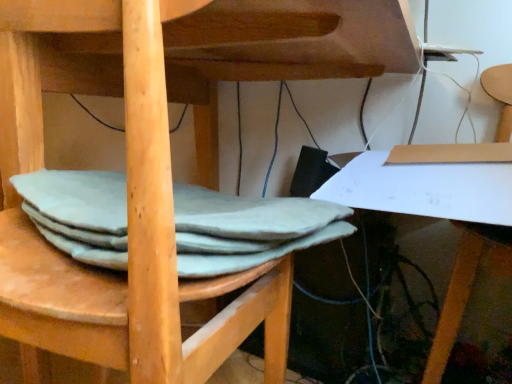
Locate an element on the screen. The height and width of the screenshot is (384, 512). matte cardboard chair at lower right is located at coordinates (460, 296).

The image size is (512, 384). What do you see at coordinates (460, 296) in the screenshot?
I see `matte cardboard chair at lower right` at bounding box center [460, 296].

You are a GUI agent. You are given a task and a screenshot of the screen. Output one action in this format:
    pyautogui.click(x=<x>, y=<y>)
    Task: Click on the light gray felt at lower left
    The image size is (512, 384).
    Given the screenshot: What is the action you would take?
    pyautogui.click(x=247, y=229)

This screenshot has width=512, height=384. What do you see at coordinates (247, 229) in the screenshot?
I see `light gray felt at lower left` at bounding box center [247, 229].

Where is `matte cardboard chair at lower right`? matte cardboard chair at lower right is located at coordinates (460, 296).

Based on their positions, is matte cardboard chair at lower right located to the left or right of light gray felt at lower left?

In the image, matte cardboard chair at lower right appears on the right side of light gray felt at lower left.

Is the position of matte cardboard chair at lower right less distant than that of light gray felt at lower left?

No, matte cardboard chair at lower right is further to the viewer.

Is point (452, 292) closer or farther from the camera than point (259, 251)?

Point (452, 292) is farther from the camera than point (259, 251).

From the image's perspective, would you say matte cardboard chair at lower right is positioned over light gray felt at lower left?

No, from the image's perspective, matte cardboard chair at lower right is not over light gray felt at lower left.

From a real-world perspective, is matte cardboard chair at lower right positioned above or below light gray felt at lower left?

Clearly, from a real-world perspective, matte cardboard chair at lower right is below light gray felt at lower left.

Between matte cardboard chair at lower right and light gray felt at lower left, which one has smaller width?

Thinner between the two is light gray felt at lower left.

From their relative heights in the image, would you say matte cardboard chair at lower right is taller or shorter than light gray felt at lower left?

matte cardboard chair at lower right is taller than light gray felt at lower left.

Between matte cardboard chair at lower right and light gray felt at lower left, which one has smaller size?

With smaller size is light gray felt at lower left.

Is matte cardboard chair at lower right not within light gray felt at lower left?

Yes, matte cardboard chair at lower right is not within light gray felt at lower left.

Is matte cardboard chair at lower right next to light gray felt at lower left?

There is a gap between matte cardboard chair at lower right and light gray felt at lower left.

Based on the photo, is matte cardboard chair at lower right positioned with its back to light gray felt at lower left?

No, light gray felt at lower left is not at the back of matte cardboard chair at lower right.

This screenshot has width=512, height=384. What are the coordinates of `chair that is on the right side of light gray felt at lower left` in the screenshot? It's located at (460, 296).

Which object is positioned more to the right, light gray felt at lower left or matte cardboard chair at lower right?

matte cardboard chair at lower right.

Is the depth of light gray felt at lower left greater than that of matte cardboard chair at lower right?

No, light gray felt at lower left is in front of matte cardboard chair at lower right.

Is point (100, 217) farther from camera compared to point (496, 92)?

That is False.

From the image's perspective, is light gray felt at lower left above or below matte cardboard chair at lower right?

light gray felt at lower left is situated higher than matte cardboard chair at lower right in the image.

From a real-world perspective, relative to matte cardboard chair at lower right, is light gray felt at lower left vertically above or below?

In terms of real-world spatial position, light gray felt at lower left is above matte cardboard chair at lower right.

Considering the sizes of objects light gray felt at lower left and matte cardboard chair at lower right in the image provided, who is thinner, light gray felt at lower left or matte cardboard chair at lower right?

light gray felt at lower left is thinner.

Who is taller, light gray felt at lower left or matte cardboard chair at lower right?

With more height is matte cardboard chair at lower right.

From the picture: Considering the sizes of objects light gray felt at lower left and matte cardboard chair at lower right in the image provided, who is bigger, light gray felt at lower left or matte cardboard chair at lower right?

matte cardboard chair at lower right is bigger.

Would you say matte cardboard chair at lower right is part of light gray felt at lower left's contents?

Definitely not — matte cardboard chair at lower right is not inside light gray felt at lower left.

Is light gray felt at lower left beside matte cardboard chair at lower right?

No.

Could you tell me if light gray felt at lower left is facing matte cardboard chair at lower right?

No, light gray felt at lower left is not aimed at matte cardboard chair at lower right.

Locate an element on the screen. chair below the light gray felt at lower left (from a real-world perspective) is located at coordinates (460, 296).

Locate an element on the screen. fabric above the matte cardboard chair at lower right (from the image's perspective) is located at coordinates (247, 229).

Find the location of a particular element. The height and width of the screenshot is (384, 512). chair behind the light gray felt at lower left is located at coordinates (460, 296).